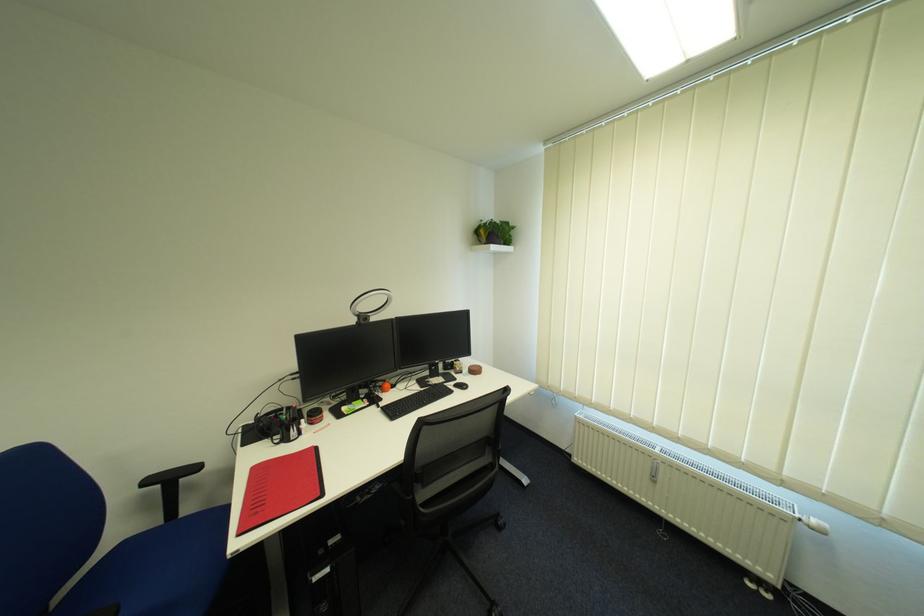
Where is `orange stress ball`? The width and height of the screenshot is (924, 616). orange stress ball is located at coordinates (384, 386).